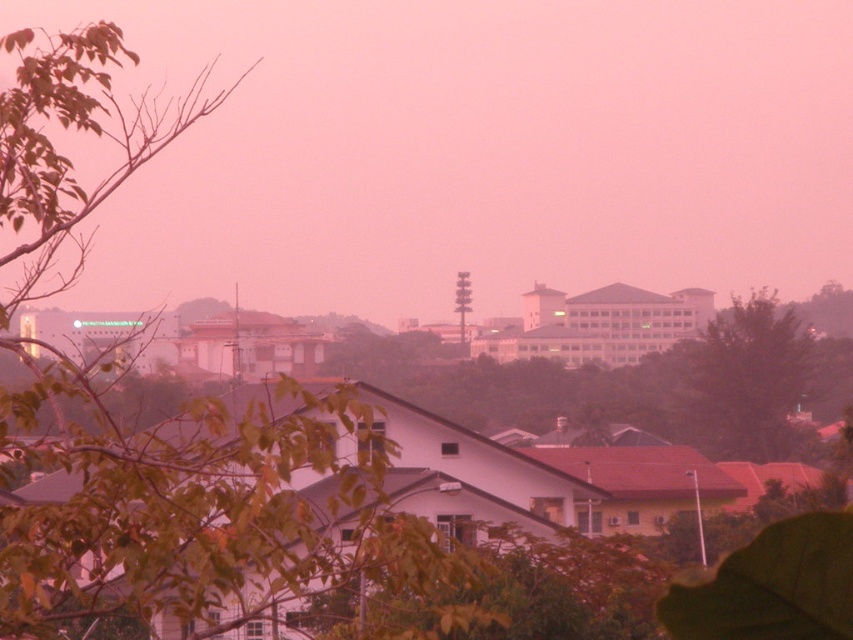
The height and width of the screenshot is (640, 853). What do you see at coordinates (195, 509) in the screenshot?
I see `green leafy tree at upper left` at bounding box center [195, 509].

Between green leafy tree at upper left and dark green leafy tree at right, which one appears on the left side from the viewer's perspective?

Positioned to the left is green leafy tree at upper left.

Between point (244, 534) and point (799, 380), which one is positioned in front?

Point (244, 534)

Find the location of a particular element. green leafy tree at upper left is located at coordinates (195, 509).